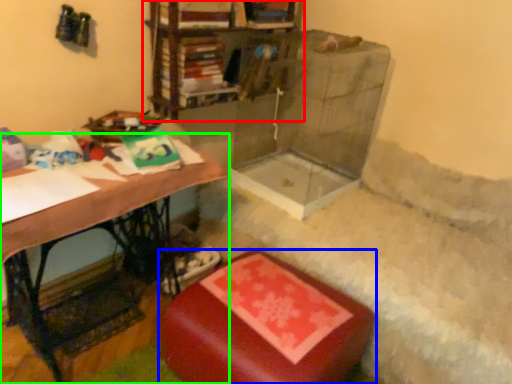
Question: Which object is positioned farthest from shelf (highlighted by a red box)? Select from furniture (highlighted by a blue box) and table (highlighted by a green box).

Choices:
 (A) furniture
 (B) table

Answer: (A)